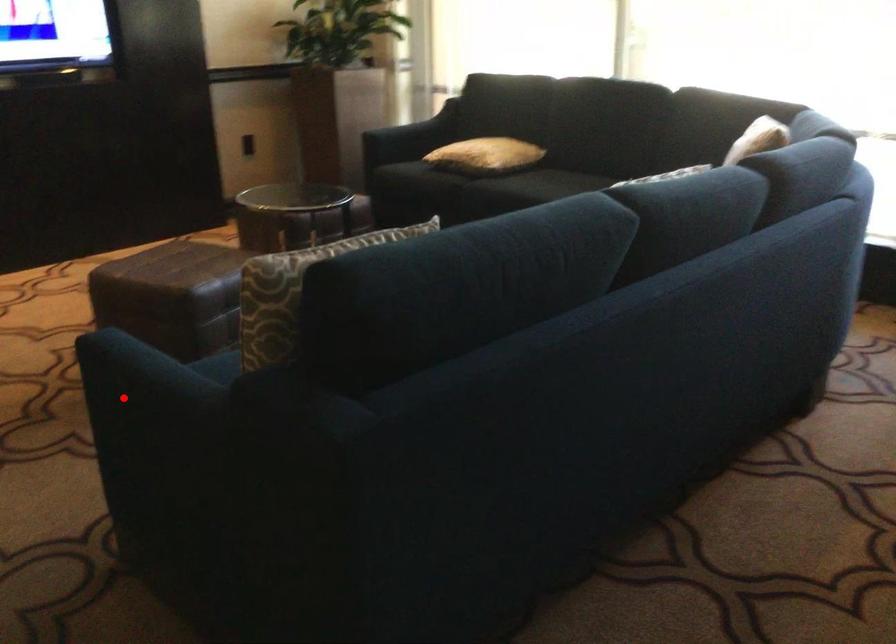
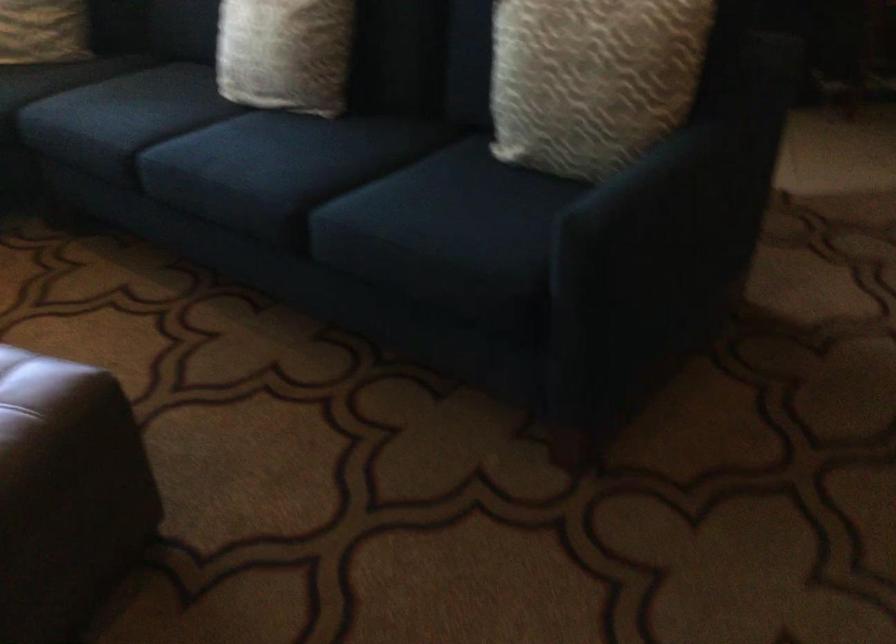
In the second image, find the point that corresponds to the highlighted location in the first image.

(687, 190)